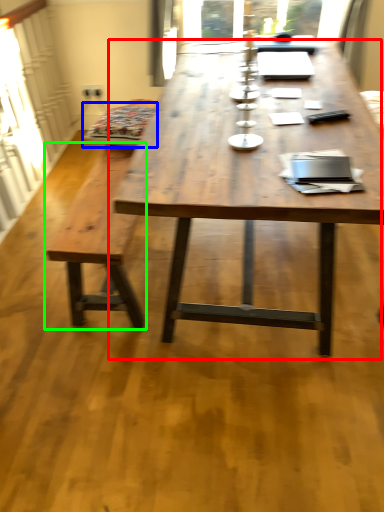
Question: Considering the real-world distances, which object is farthest from coffee table (highlighted by a red box)? swivel chair (highlighted by a blue box) or bench (highlighted by a green box)?

Choices:
 (A) swivel chair
 (B) bench

Answer: (A)